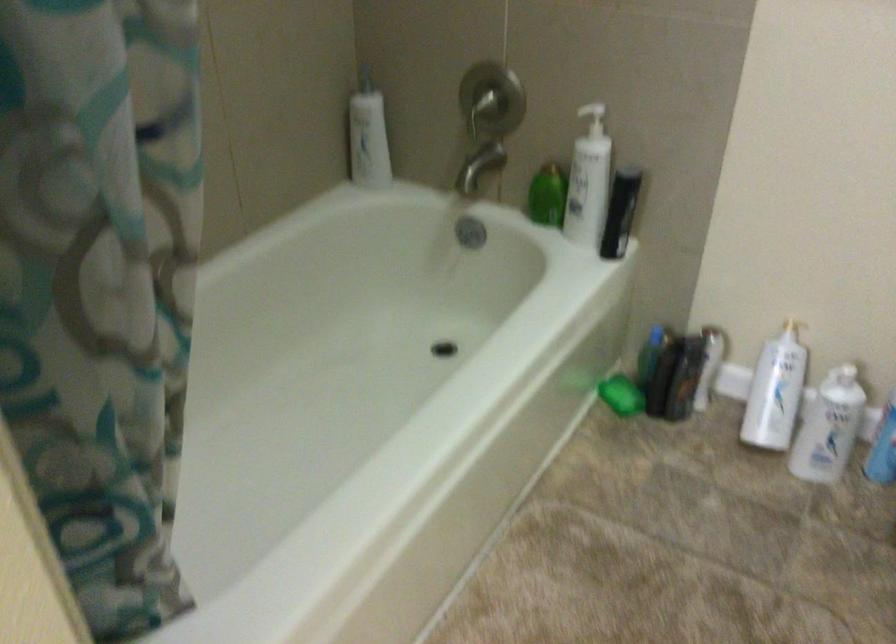
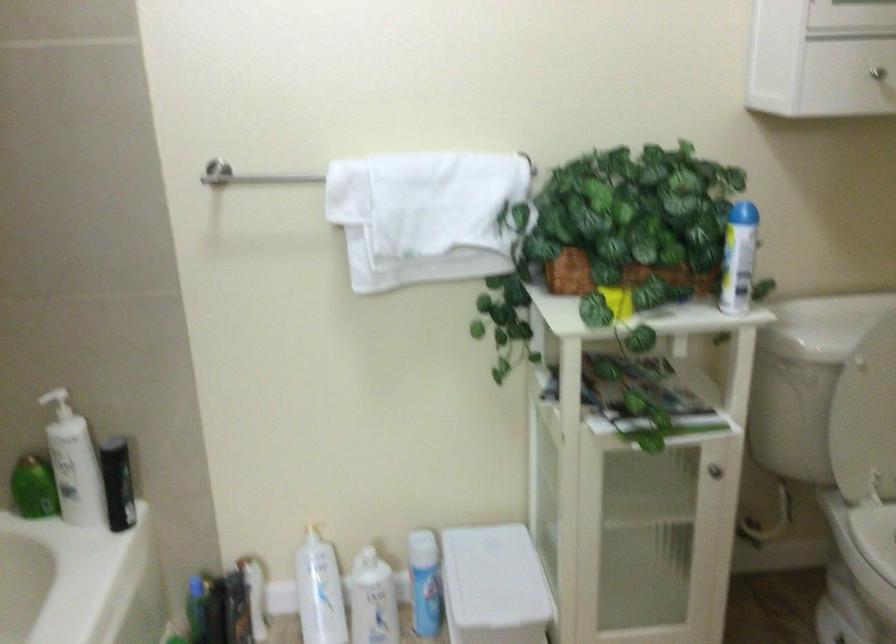
Locate, in the second image, the point that corresponds to point 613,214 in the first image.

(117, 483)